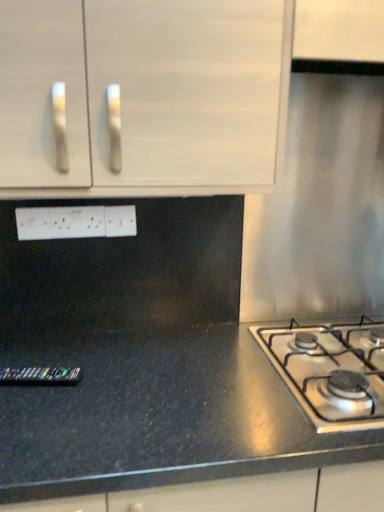
Question: Is satin silver gas stove at lower right in front of white matte cabinet at upper left?

Choices:
 (A) yes
 (B) no

Answer: (B)

Question: Does satin silver gas stove at lower right have a larger size compared to white matte cabinet at upper left?

Choices:
 (A) yes
 (B) no

Answer: (B)

Question: Is satin silver gas stove at lower right wider than white matte cabinet at upper left?

Choices:
 (A) no
 (B) yes

Answer: (B)

Question: From a real-world perspective, is satin silver gas stove at lower right below white matte cabinet at upper left?

Choices:
 (A) no
 (B) yes

Answer: (B)

Question: From a real-world perspective, does satin silver gas stove at lower right stand above white matte cabinet at upper left?

Choices:
 (A) no
 (B) yes

Answer: (A)

Question: Does satin silver gas stove at lower right contain white matte cabinet at upper left?

Choices:
 (A) no
 (B) yes

Answer: (A)

Question: Is black granite countertop at lower left completely or partially outside of white matte cabinet at upper left?

Choices:
 (A) no
 (B) yes

Answer: (B)

Question: Does black granite countertop at lower left have a greater height compared to white matte cabinet at upper left?

Choices:
 (A) no
 (B) yes

Answer: (B)

Question: Can you confirm if black granite countertop at lower left is thinner than white matte cabinet at upper left?

Choices:
 (A) no
 (B) yes

Answer: (A)

Question: Can you see black granite countertop at lower left touching white matte cabinet at upper left?

Choices:
 (A) yes
 (B) no

Answer: (B)

Question: Is black granite countertop at lower left aimed at white matte cabinet at upper left?

Choices:
 (A) no
 (B) yes

Answer: (A)

Question: Does black granite countertop at lower left have a greater width compared to white matte cabinet at upper left?

Choices:
 (A) yes
 (B) no

Answer: (A)

Question: Considering the relative sizes of white plastic electrical outlet at center, marked as the first electric outlet in a left-to-right arrangement, and black granite countertop at lower left in the image provided, is white plastic electrical outlet at center, marked as the first electric outlet in a left-to-right arrangement, shorter than black granite countertop at lower left?

Choices:
 (A) yes
 (B) no

Answer: (A)